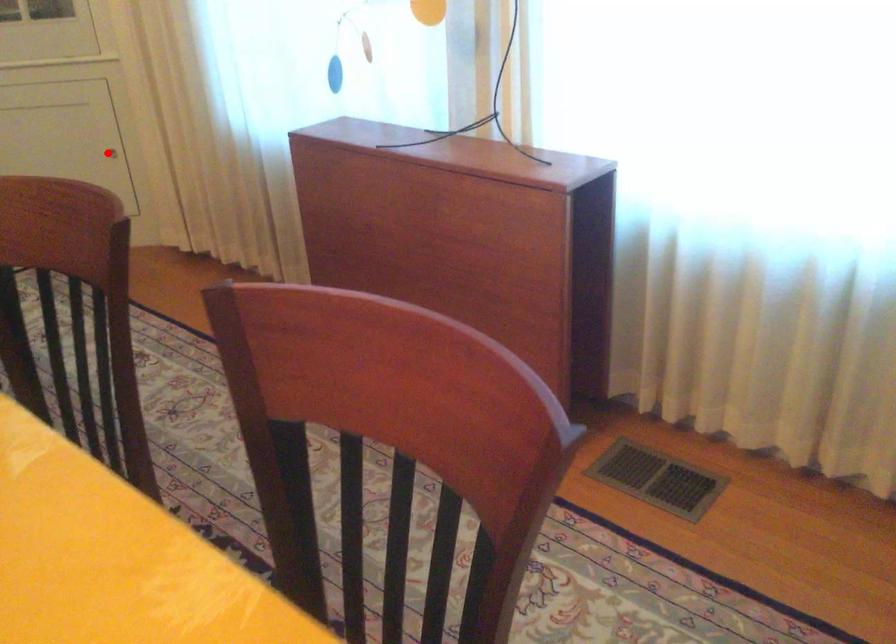
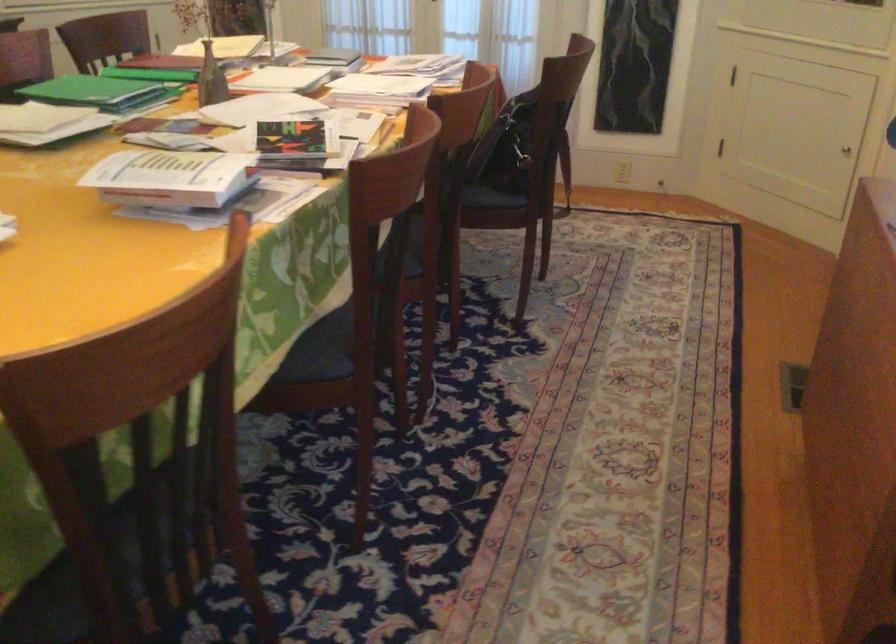
Question: I am providing you with two images of the same scene from different viewpoints. A red point is marked on the first image. Is the red point's position out of view in image 2?

Choices:
 (A) Yes
 (B) No

Answer: (B)